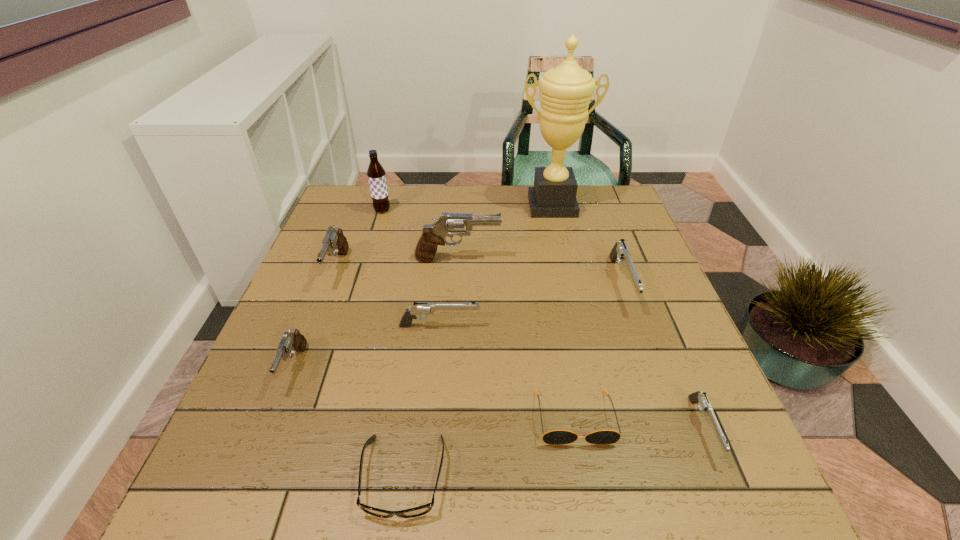
The height and width of the screenshot is (540, 960). What are the coordinates of `trophy cup` in the screenshot? It's located at (565, 91).

Find the location of a particular element. Image resolution: width=960 pixels, height=540 pixels. the tallest object is located at coordinates (565, 91).

The width and height of the screenshot is (960, 540). Find the location of `the second tallest object`. the second tallest object is located at coordinates (376, 175).

Locate an element on the screen. root beer is located at coordinates (376, 175).

This screenshot has height=540, width=960. In order to click on the tallest pistol in this screenshot , I will do `click(449, 224)`.

Locate an element on the screen. The image size is (960, 540). the eighth shortest object is located at coordinates (449, 224).

Find the location of a particular element. This screenshot has height=540, width=960. the second biggest gray pistol is located at coordinates (335, 243).

This screenshot has width=960, height=540. Identify the location of the seventh shortest object. (335, 243).

Identify the location of the second silver pistol from right to left. (620, 252).

Where is `the biggest silver pistol`? the biggest silver pistol is located at coordinates tap(620, 252).